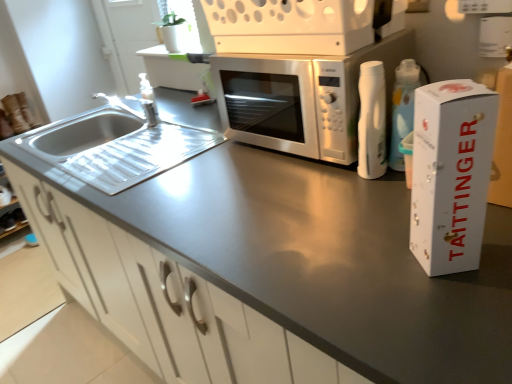
Question: Can you confirm if satin silver microwave at center is taller than white matte cabinet at center?

Choices:
 (A) no
 (B) yes

Answer: (A)

Question: Is satin silver microwave at center behind white matte cabinet at center?

Choices:
 (A) yes
 (B) no

Answer: (A)

Question: Does satin silver microwave at center appear on the left side of white matte cabinet at center?

Choices:
 (A) no
 (B) yes

Answer: (A)

Question: Is satin silver microwave at center located outside white matte cabinet at center?

Choices:
 (A) yes
 (B) no

Answer: (A)

Question: Does satin silver microwave at center have a lesser width compared to white matte cabinet at center?

Choices:
 (A) no
 (B) yes

Answer: (B)

Question: Is there a large distance between satin silver microwave at center and white matte cabinet at center?

Choices:
 (A) yes
 (B) no

Answer: (B)

Question: Considering the relative sizes of white cardboard box at right and white matte cabinet at center in the image provided, is white cardboard box at right shorter than white matte cabinet at center?

Choices:
 (A) yes
 (B) no

Answer: (A)

Question: Does white cardboard box at right come behind white matte cabinet at center?

Choices:
 (A) yes
 (B) no

Answer: (A)

Question: Is white cardboard box at right at the left side of white matte cabinet at center?

Choices:
 (A) no
 (B) yes

Answer: (A)

Question: Would you consider white cardboard box at right to be distant from white matte cabinet at center?

Choices:
 (A) yes
 (B) no

Answer: (B)

Question: Considering the relative sizes of white cardboard box at right and white matte cabinet at center in the image provided, is white cardboard box at right smaller than white matte cabinet at center?

Choices:
 (A) no
 (B) yes

Answer: (B)

Question: From a real-world perspective, is white cardboard box at right physically above white matte cabinet at center?

Choices:
 (A) yes
 (B) no

Answer: (A)

Question: Can you confirm if satin silver microwave at center is positioned to the left of satin silver microwave at center?

Choices:
 (A) no
 (B) yes

Answer: (A)